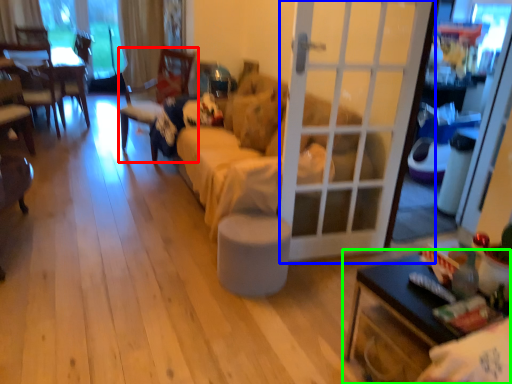
Question: Based on their relative distances, which object is nearer to chair (highlighted by a red box)? Choose from door (highlighted by a blue box) and table (highlighted by a green box).

Choices:
 (A) door
 (B) table

Answer: (A)